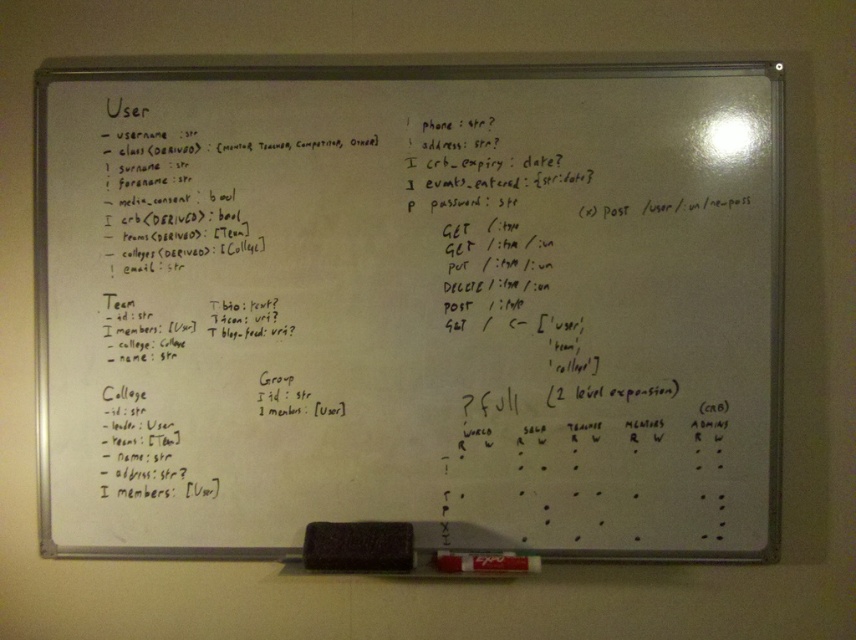
You are a teacher who needs to write a note on the whiteboard at center. You have a black matte marker at bottom. Will the marker fit comfortably in your hand while writing?

The black matte marker at bottom is smaller than the whiteboard at center, so it should fit comfortably in your hand while writing.

Looking at this image, you are a teacher standing in front of the whiteboard at center and want to write a note. Do you need to bend down to reach the black matte marker at bottom?

The whiteboard at center is above the black matte marker at bottom, so you don not need to bend down to reach the black matte marker at bottom since it is placed lower than the whiteboard at center.